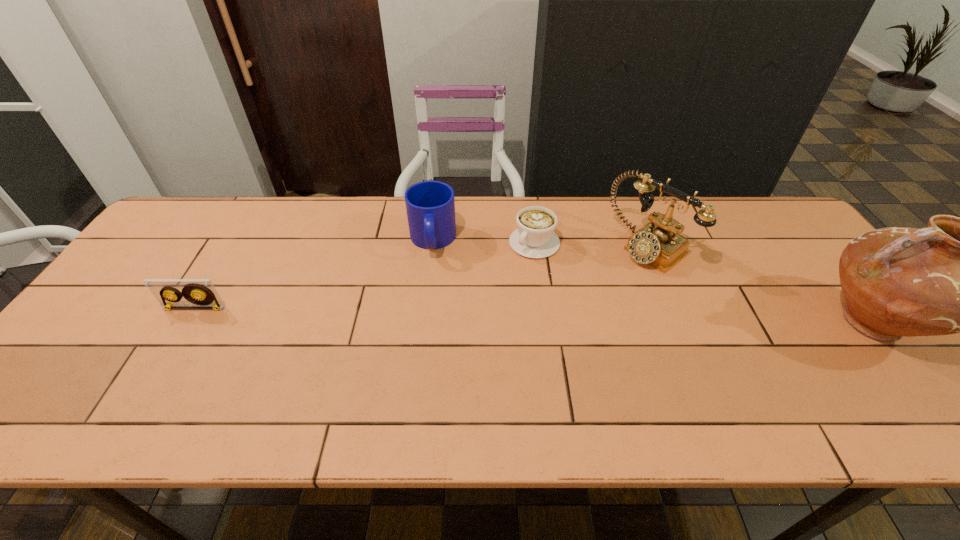
This screenshot has width=960, height=540. Identify the location of the leftmost object. (198, 293).

Where is `cappuccino`? cappuccino is located at coordinates (535, 238).

Image resolution: width=960 pixels, height=540 pixels. I want to click on the second object from left to right, so click(430, 205).

Where is `mug`? mug is located at coordinates (430, 205).

The width and height of the screenshot is (960, 540). I want to click on the fourth shortest object, so click(658, 243).

At what (x,y) coordinates should I click in order to perform the action: click on the fourth object from left to right. Please return your answer as a coordinate pair (x, y). Image resolution: width=960 pixels, height=540 pixels. Looking at the image, I should click on (658, 243).

The height and width of the screenshot is (540, 960). I want to click on vacant space located 0.220m at the front of the leftmost object with visible reels, so click(x=147, y=387).

I want to click on vacant space located 0.130m to the right of the cappuccino's handle, so click(497, 284).

Locate an element on the screen. The image size is (960, 540). free space located 0.120m to the right of the cappuccino's handle is located at coordinates (499, 282).

Find the location of a particular element. The image size is (960, 540). free space located to the right of the cappuccino's handle is located at coordinates (488, 295).